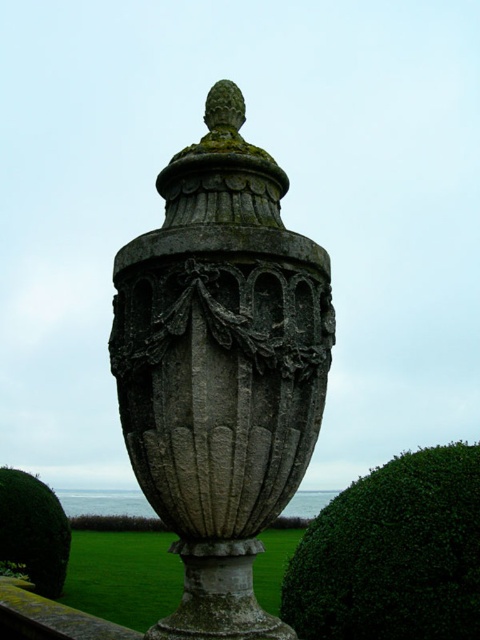
Question: Can you confirm if green leafy bush at lower right is positioned above green leafy bush at lower left?

Choices:
 (A) no
 (B) yes

Answer: (B)

Question: Estimate the real-world distances between objects in this image. Which object is farther from the green leafy bush at lower left?

Choices:
 (A) gray stone urn at center
 (B) green leafy bush at lower right

Answer: (A)

Question: Is gray stone urn at center to the right of green leafy bush at lower right from the viewer's perspective?

Choices:
 (A) yes
 (B) no

Answer: (B)

Question: Is the position of gray stone urn at center more distant than that of green leafy bush at lower left?

Choices:
 (A) yes
 (B) no

Answer: (B)

Question: Which point is closer to the camera taking this photo?

Choices:
 (A) (25, 534)
 (B) (220, 524)
 (C) (364, 582)

Answer: (B)

Question: Which point is closer to the camera taking this photo?

Choices:
 (A) (13, 552)
 (B) (327, 540)

Answer: (B)